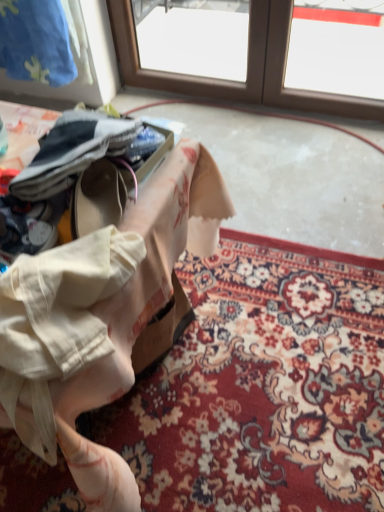
Question: Considering the relative sizes of floral carpet at lower center and floral fabric at center in the image provided, is floral carpet at lower center wider than floral fabric at center?

Choices:
 (A) yes
 (B) no

Answer: (A)

Question: Could you tell me if floral carpet at lower center is facing floral fabric at center?

Choices:
 (A) yes
 (B) no

Answer: (B)

Question: From a real-world perspective, is floral carpet at lower center positioned under floral fabric at center based on gravity?

Choices:
 (A) no
 (B) yes

Answer: (B)

Question: From the image's perspective, does floral carpet at lower center appear lower than floral fabric at center?

Choices:
 (A) yes
 (B) no

Answer: (A)

Question: Would you consider floral carpet at lower center to be distant from floral fabric at center?

Choices:
 (A) yes
 (B) no

Answer: (B)

Question: Are floral carpet at lower center and floral fabric at center making contact?

Choices:
 (A) no
 (B) yes

Answer: (A)

Question: Can you confirm if floral fabric at center is wider than floral carpet at lower center?

Choices:
 (A) no
 (B) yes

Answer: (A)

Question: Does floral fabric at center have a lesser height compared to floral carpet at lower center?

Choices:
 (A) no
 (B) yes

Answer: (A)

Question: From a real-world perspective, does floral fabric at center stand above floral carpet at lower center?

Choices:
 (A) yes
 (B) no

Answer: (A)

Question: From the image's perspective, is floral fabric at center located above floral carpet at lower center?

Choices:
 (A) yes
 (B) no

Answer: (A)

Question: Does floral fabric at center have a lesser width compared to floral carpet at lower center?

Choices:
 (A) no
 (B) yes

Answer: (B)

Question: Would you say floral carpet at lower center is part of floral fabric at center's contents?

Choices:
 (A) yes
 (B) no

Answer: (B)

Question: In the image, is floral fabric at center positioned in front of or behind floral carpet at lower center?

Choices:
 (A) front
 (B) behind

Answer: (A)